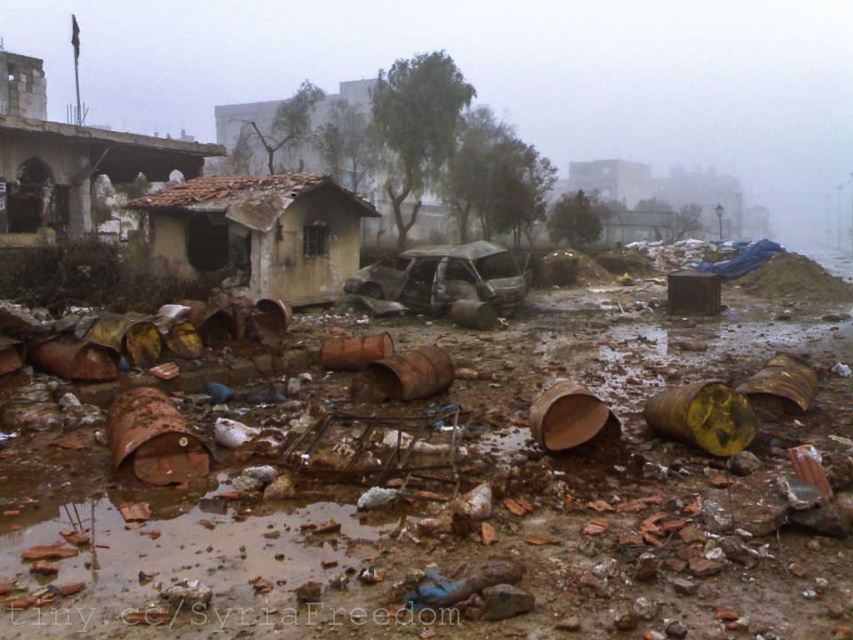
Question: Estimate the real-world distances between objects in this image. Which object is farther from the yellowish concrete hut at center?

Choices:
 (A) rusty metal hut at upper center
 (B) rusty corrugated metal hut at upper left
 (C) brown corrugated metal hut at center

Answer: (A)

Question: Which object is farther from the camera taking this photo?

Choices:
 (A) rusty metal hut at upper center
 (B) brown corrugated metal hut at center
 (C) yellowish concrete hut at center
 (D) rusty corrugated metal hut at upper left

Answer: (A)

Question: Can you confirm if yellowish concrete hut at center is wider than rusty metal hut at upper center?

Choices:
 (A) yes
 (B) no

Answer: (B)

Question: Can you confirm if rusty corrugated metal hut at upper left is wider than rusty metal hut at upper center?

Choices:
 (A) no
 (B) yes

Answer: (B)

Question: Which of these objects is positioned closest to the rusty metal hut at upper center?

Choices:
 (A) yellowish concrete hut at center
 (B) rusty corrugated metal hut at upper left
 (C) brown corrugated metal hut at center

Answer: (C)

Question: Does yellowish concrete hut at center have a lesser width compared to rusty metal hut at upper center?

Choices:
 (A) yes
 (B) no

Answer: (A)